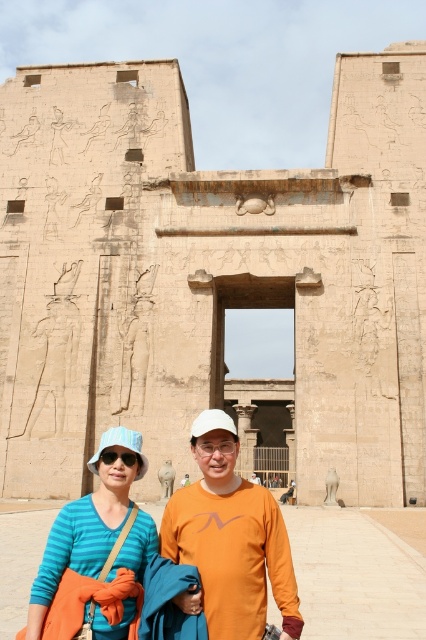
Can you confirm if beige stone temple at center is positioned to the left of orange matte shirt at center?

Yes, beige stone temple at center is to the left of orange matte shirt at center.

Does beige stone temple at center appear over orange matte shirt at center?

Yes.

Who is more forward, (x=393, y=250) or (x=215, y=518)?

Point (x=215, y=518) is in front.

At what (x,y) coordinates should I click in order to perform the action: click on beige stone temple at center. Please return your answer as a coordinate pair (x, y). This screenshot has width=426, height=640. Looking at the image, I should click on (209, 275).

Is orange matte shirt at center positioned in front of blue striped shirt at center?

No, orange matte shirt at center is further to the viewer.

Does orange matte shirt at center appear under blue striped shirt at center?

No, orange matte shirt at center is not below blue striped shirt at center.

The height and width of the screenshot is (640, 426). Identify the location of orange matte shirt at center. (230, 540).

Can you confirm if beige stone temple at center is smaller than blue striped shirt at center?

Actually, beige stone temple at center might be larger than blue striped shirt at center.

Does beige stone temple at center appear over blue striped shirt at center?

Indeed, beige stone temple at center is positioned over blue striped shirt at center.

Locate an element on the screen. The image size is (426, 640). beige stone temple at center is located at coordinates (209, 275).

Locate an element on the screen. The width and height of the screenshot is (426, 640). beige stone temple at center is located at coordinates (209, 275).